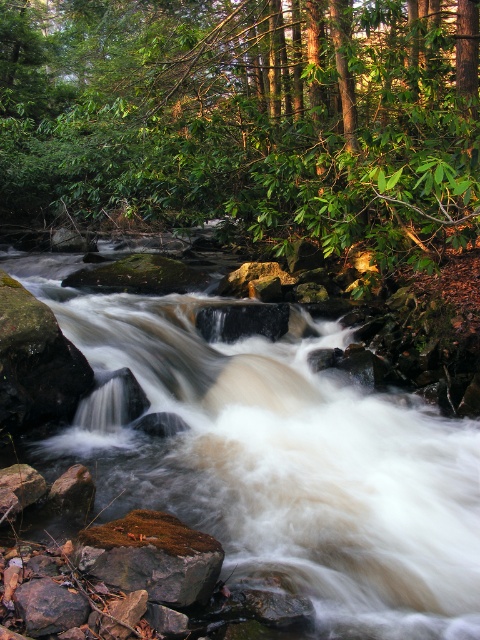
Can you confirm if brown smooth rock at center is positioned to the left of green mossy rock at lower center?

No, brown smooth rock at center is not to the left of green mossy rock at lower center.

You are a GUI agent. You are given a task and a screenshot of the screen. Output one action in this format:
    pyautogui.click(x=<x>, y=<y>)
    Task: Click on the brown smooth rock at center
    
    Given the screenshot: What is the action you would take?
    pyautogui.click(x=277, y=460)

I want to click on brown smooth rock at center, so click(277, 460).

You are a GUI agent. You are given a task and a screenshot of the screen. Output one action in this format:
    pyautogui.click(x=<x>, y=<y>)
    Task: Click on the brown smooth rock at center
    This screenshot has height=640, width=480.
    Given the screenshot: What is the action you would take?
    pyautogui.click(x=277, y=460)

Is green leafy tree at center behind green mossy rock at lower center?

That is True.

Does green leafy tree at center appear under green mossy rock at lower center?

Actually, green leafy tree at center is above green mossy rock at lower center.

Who is more forward, (x=91, y=49) or (x=135, y=584)?

Point (x=135, y=584)

Find the location of `green leafy tree at center`. green leafy tree at center is located at coordinates (245, 120).

Can you confirm if brown smooth rock at center is positioned above brown rough rock at lower left?

Actually, brown smooth rock at center is below brown rough rock at lower left.

Who is taller, brown smooth rock at center or brown rough rock at lower left?

brown rough rock at lower left is taller.

This screenshot has height=640, width=480. What do you see at coordinates (277, 460) in the screenshot?
I see `brown smooth rock at center` at bounding box center [277, 460].

What are the coordinates of `brown smooth rock at center` in the screenshot? It's located at (277, 460).